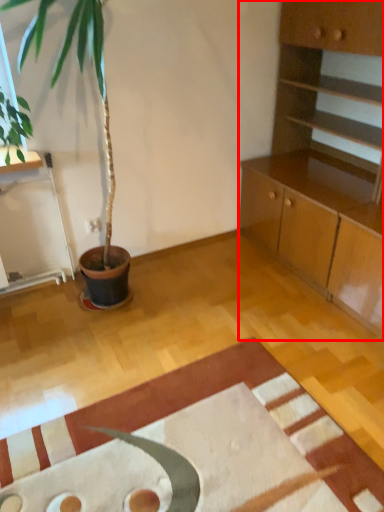
Question: From the image, what is the correct spatial relationship of cabinetry (annotated by the red box) in relation to mat?

Choices:
 (A) left
 (B) right

Answer: (B)